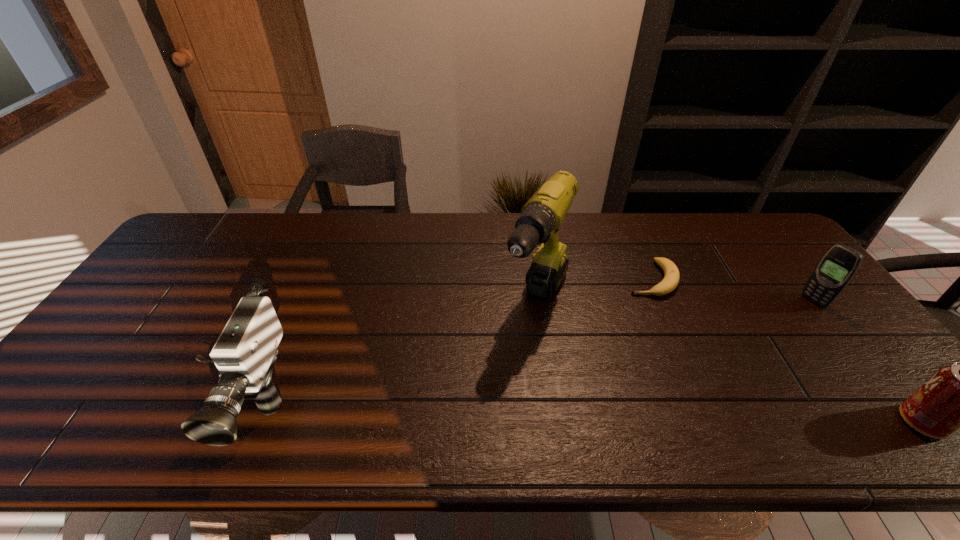
I want to click on cellular telephone located at the right edge, so click(837, 267).

What are the coordinates of `object that is at the near right corner` in the screenshot? It's located at (959, 396).

Image resolution: width=960 pixels, height=540 pixels. I want to click on blank area at the far edge, so click(364, 216).

The height and width of the screenshot is (540, 960). What are the coordinates of `free space at the near edge` in the screenshot? It's located at (579, 385).

Locate an element on the screen. free region at the left edge of the desktop is located at coordinates (124, 332).

Identify the location of free space at the right edge of the desktop. This screenshot has height=540, width=960. (805, 302).

The height and width of the screenshot is (540, 960). Find the location of `vacant region at the far left corner of the desktop`. vacant region at the far left corner of the desktop is located at coordinates [x=209, y=217].

Identify the location of vacant area at the far right corner of the desktop. This screenshot has height=540, width=960. (737, 233).

At what (x,y) coordinates should I click in order to perform the action: click on vacant point located between the shortest object and the drill. Please return your answer as a coordinate pair (x, y). Looking at the image, I should click on (594, 291).

The image size is (960, 540). Find the location of `free spot between the fourth object from right to left and the cellular telephone`. free spot between the fourth object from right to left and the cellular telephone is located at coordinates (675, 302).